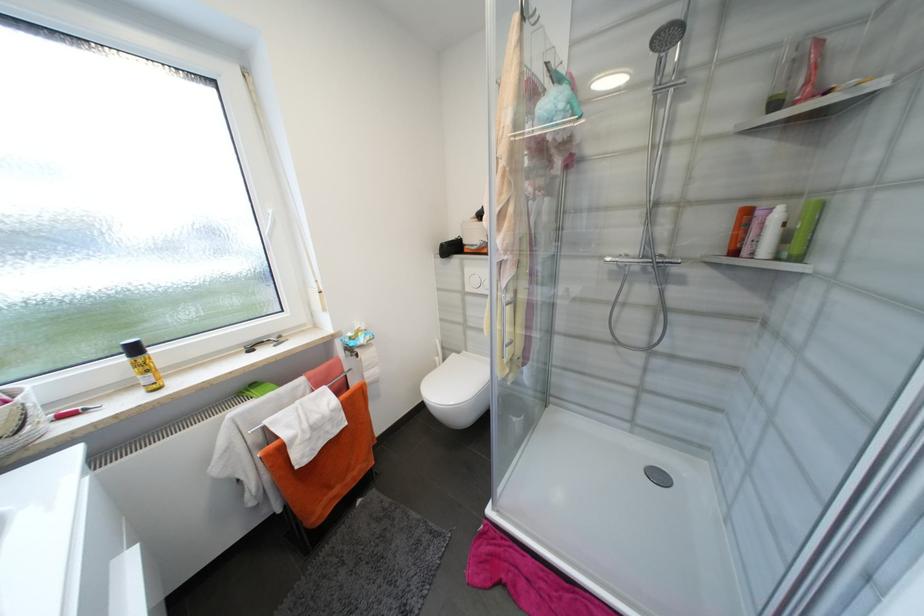
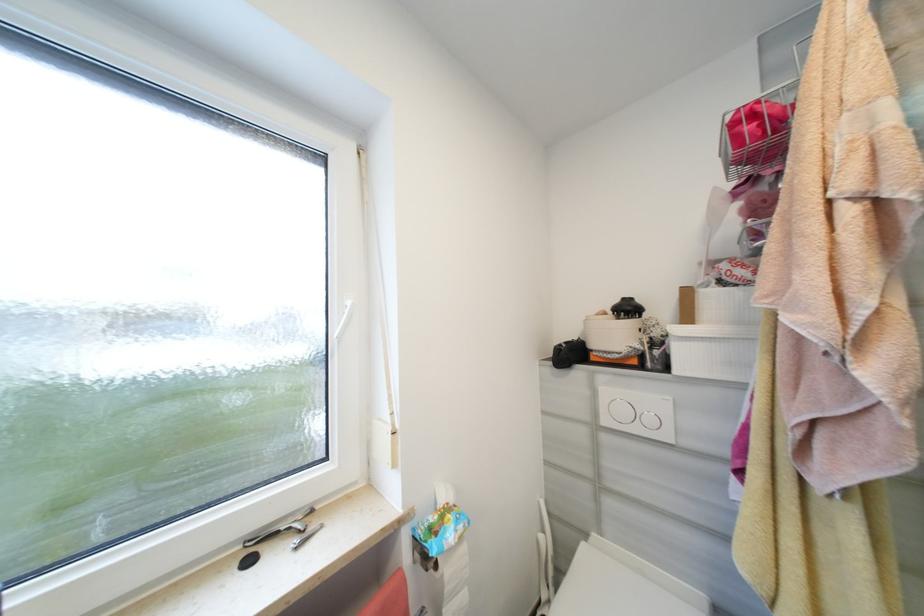
Question: How did the camera likely rotate?

Choices:
 (A) Left
 (B) Right
 (C) Up
 (D) Down

Answer: (C)